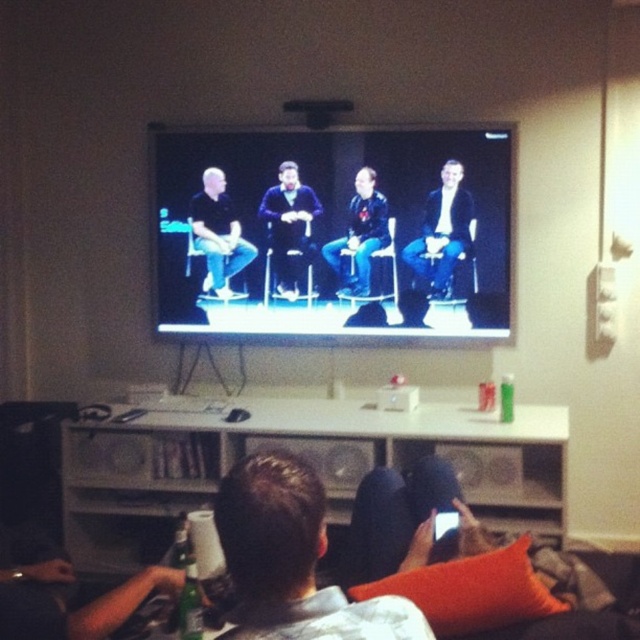
You are standing in the room and want to sit down. There are matte black chairs at center. Where should you go to find them?

The matte black chairs at center are located at point [332,232] in the room.

You are sitting in the room and want to hand a note to the person wearing the dark blue sweater at center. The matte black chairs at center are blocking your path. Can you move around the chairs to reach the sweater?

The matte black chairs at center is to the right of dark blue sweater at center, so you can move around the left side of the chairs to reach the dark blue sweater at center.